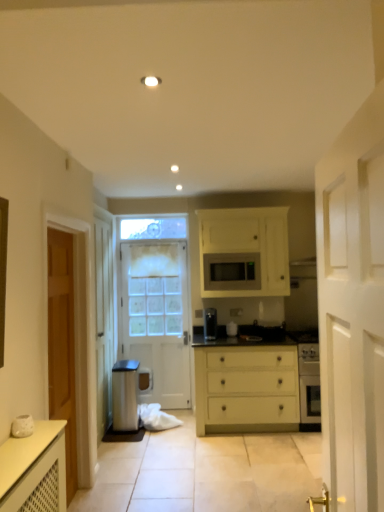
Question: Does matte yellow chest of drawers at center have a greater width compared to white wooden door at right, the 2th door viewed from the right?

Choices:
 (A) no
 (B) yes

Answer: (B)

Question: Is matte yellow chest of drawers at center to the right of white wooden door at right, which appears as the first door when viewed from the front, from the viewer's perspective?

Choices:
 (A) no
 (B) yes

Answer: (B)

Question: Is white wooden door at right, the 2th door viewed from the right, located within matte yellow chest of drawers at center?

Choices:
 (A) yes
 (B) no

Answer: (B)

Question: Is matte yellow chest of drawers at center with white wooden door at right, which appears as the first door when viewed from the front?

Choices:
 (A) yes
 (B) no

Answer: (B)

Question: Considering the relative sizes of matte yellow chest of drawers at center and white wooden door at right, placed as the 3th door when sorted from back to front, in the image provided, is matte yellow chest of drawers at center thinner than white wooden door at right, placed as the 3th door when sorted from back to front,?

Choices:
 (A) no
 (B) yes

Answer: (A)

Question: Is matte yellow chest of drawers at center shorter than white wooden door at right, the second door viewed from the left?

Choices:
 (A) no
 (B) yes

Answer: (B)

Question: Considering the relative sizes of matte black microwave at center and white wooden door at right, the 2th door viewed from the right, in the image provided, is matte black microwave at center taller than white wooden door at right, the 2th door viewed from the right,?

Choices:
 (A) no
 (B) yes

Answer: (A)

Question: Is matte black microwave at center smaller than white wooden door at right, the second door viewed from the left?

Choices:
 (A) no
 (B) yes

Answer: (B)

Question: Could white wooden door at right, the 2th door viewed from the right, be considered to be inside matte black microwave at center?

Choices:
 (A) yes
 (B) no

Answer: (B)

Question: Is white wooden door at right, the 2th door viewed from the right, at the back of matte black microwave at center?

Choices:
 (A) yes
 (B) no

Answer: (B)

Question: Is matte black microwave at center not close to white wooden door at right, the second door viewed from the left?

Choices:
 (A) no
 (B) yes

Answer: (B)

Question: Is matte black microwave at center not within white wooden door at right, which appears as the first door when viewed from the front?

Choices:
 (A) no
 (B) yes

Answer: (B)

Question: Can you confirm if white wooden door at right, placed as the 3th door when sorted from back to front, is shorter than matte black microwave at center?

Choices:
 (A) yes
 (B) no

Answer: (B)